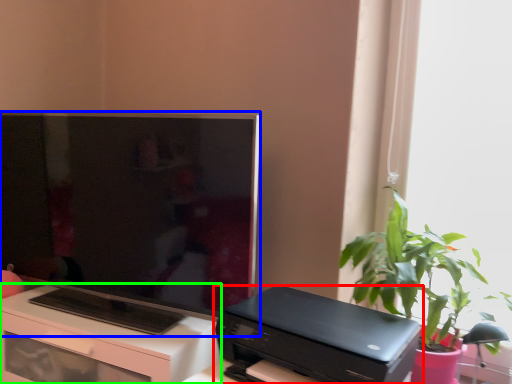
Question: Based on their relative distances, which object is nearer to printer (highlighted by a red box)? Choose from television (highlighted by a blue box) and desk (highlighted by a green box).

Choices:
 (A) television
 (B) desk

Answer: (B)